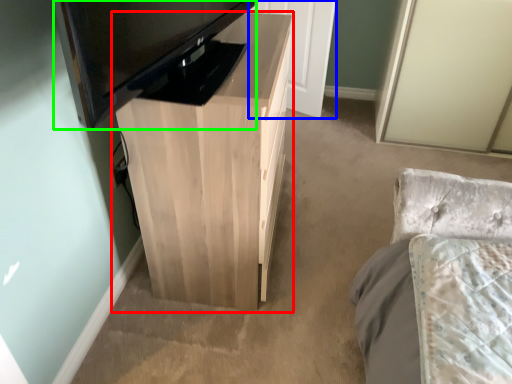
Question: Which object is positioned closest to table (highlighted by a red box)? Select from door (highlighted by a blue box) and television (highlighted by a green box).

Choices:
 (A) door
 (B) television

Answer: (B)